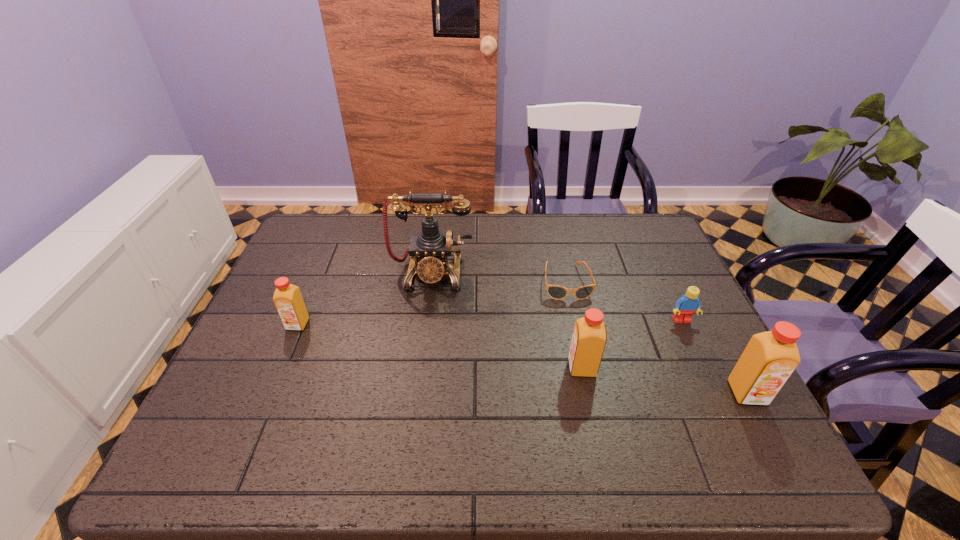
You are a GUI agent. You are given a task and a screenshot of the screen. Output one action in this format:
    pyautogui.click(x=<x>, y=<y>)
    Task: Click on the third shortest object
    
    Given the screenshot: What is the action you would take?
    pyautogui.click(x=287, y=298)

You are a GUI agent. You are given a task and a screenshot of the screen. Output one action in this format:
    pyautogui.click(x=<x>, y=<y>)
    Task: Click on the farthest orange juice
    
    Given the screenshot: What is the action you would take?
    pyautogui.click(x=287, y=298)

Where is `the fifth farthest object`? This screenshot has height=540, width=960. the fifth farthest object is located at coordinates (589, 338).

Locate an element on the screen. Image resolution: width=960 pixels, height=540 pixels. the second orange juice from left to right is located at coordinates (589, 338).

Identify the location of the rightmost orange juice. Image resolution: width=960 pixels, height=540 pixels. (769, 359).

The image size is (960, 540). In order to click on the nearest orange juice in this screenshot , I will do `click(769, 359)`.

I want to click on the fifth object from right to left, so click(x=429, y=250).

Locate an element on the screen. This screenshot has width=960, height=540. the tallest object is located at coordinates (429, 250).

You are a GUI agent. You are given a task and a screenshot of the screen. Output one action in this format:
    pyautogui.click(x=<x>, y=<y>)
    Task: Click on the shortest object
    The width and height of the screenshot is (960, 540).
    Given the screenshot: What is the action you would take?
    pyautogui.click(x=556, y=292)

The width and height of the screenshot is (960, 540). I want to click on Lego, so click(x=689, y=303).